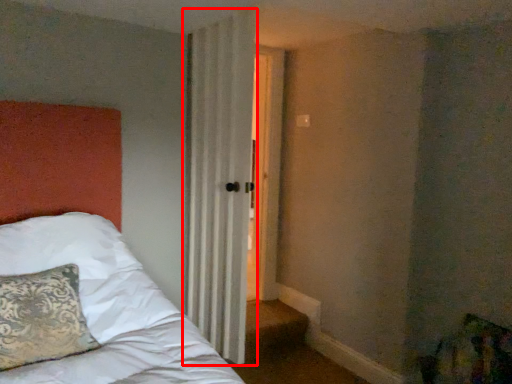
Question: In this image, where is curtain (annotated by the red box) located relative to pillow?

Choices:
 (A) left
 (B) right

Answer: (B)